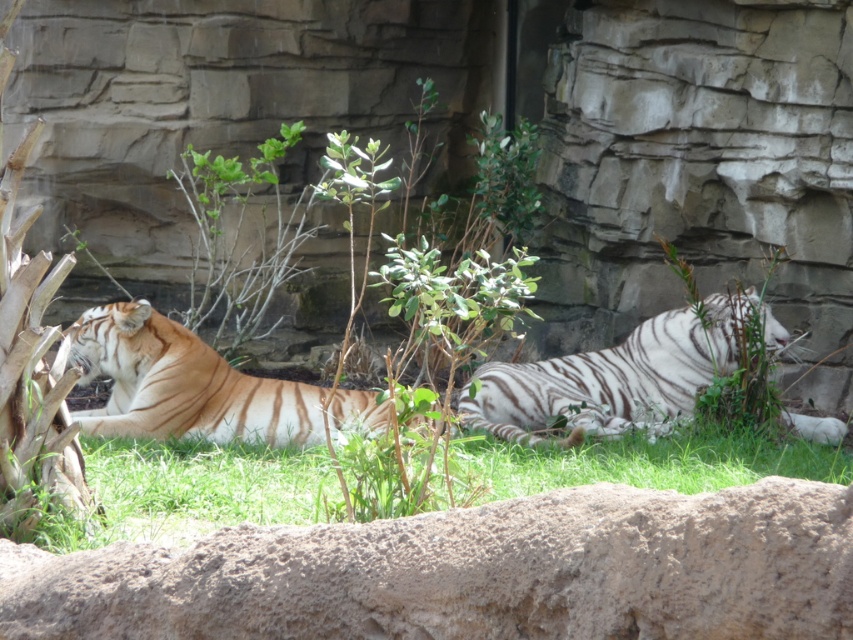
Who is positioned more to the right, green grass at center or orange fur tiger at left?

orange fur tiger at left is more to the right.

Is green grass at center to the right of orange fur tiger at left from the viewer's perspective?

No, green grass at center is not to the right of orange fur tiger at left.

Find the location of a particular element. green grass at center is located at coordinates (190, 492).

Does orange fur tiger at left appear under white striped tiger at center?

Yes.

Does orange fur tiger at left have a lesser height compared to white striped tiger at center?

Yes.

Based on the photo, measure the distance between orange fur tiger at left and camera.

They are 11.80 meters apart.

You are a GUI agent. You are given a task and a screenshot of the screen. Output one action in this format:
    pyautogui.click(x=<x>, y=<y>)
    Task: Click on the orange fur tiger at left
    
    Given the screenshot: What is the action you would take?
    pyautogui.click(x=198, y=387)

Does green grass at center appear under white striped tiger at center?

Correct, green grass at center is located below white striped tiger at center.

Who is more distant from viewer, (798, 458) or (639, 392)?

The point (639, 392) is behind.

The height and width of the screenshot is (640, 853). Identify the location of green grass at center. point(190,492).